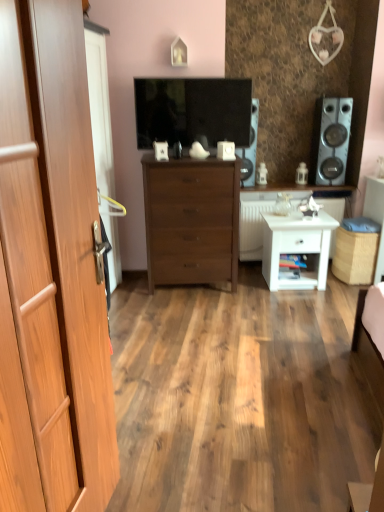
Measure the distance between matte black tv at center and camera.

matte black tv at center and camera are 11.30 feet apart.

Locate an element on the screen. Image resolution: width=384 pixels, height=512 pixels. matte black tv at center is located at coordinates (193, 111).

Locate an element on the screen. This screenshot has height=512, width=384. white glossy side table at center right, placed as the 2th counter top when sorted from top to bottom is located at coordinates (273, 209).

Describe the element at coordinates (191, 221) in the screenshot. I see `brown wooden chest of drawers at center` at that location.

This screenshot has width=384, height=512. What are the coordinates of `white matte nightstand at lower right` in the screenshot? It's located at (296, 249).

Locate an element on the screen. This screenshot has width=384, height=512. matte black speaker at center, which ranks as the second speaker in right-to-left order is located at coordinates (249, 150).

Looking at their sizes, would you say light brown wood door at left is wider or thinner than wooden cabinet at center, which is the second counter top in bottom-to-top order?

light brown wood door at left is thinner than wooden cabinet at center, which is the second counter top in bottom-to-top order.

In the scene shown: Is light brown wood door at left not close to wooden cabinet at center, the 1th counter top when ordered from top to bottom?

Yes, light brown wood door at left and wooden cabinet at center, the 1th counter top when ordered from top to bottom, are located far from each other.

Between light brown wood door at left and wooden cabinet at center, the 1th counter top when ordered from top to bottom, which one has smaller size?

Smaller between the two is wooden cabinet at center, the 1th counter top when ordered from top to bottom.

Which is farther from the camera, (x=82, y=426) or (x=328, y=190)?

Point (x=328, y=190)

Can you tell me how much brown wooden chest of drawers at center and matte black speaker at center, placed as the 1th speaker when sorted from left to right, differ in facing direction?

9.3 degrees separate the facing orientations of brown wooden chest of drawers at center and matte black speaker at center, placed as the 1th speaker when sorted from left to right.

Does brown wooden chest of drawers at center have a smaller size compared to matte black speaker at center, placed as the 1th speaker when sorted from left to right?

No.

Is brown wooden chest of drawers at center with matte black speaker at center, placed as the 1th speaker when sorted from left to right?

No.

From a real-world perspective, is brown wooden chest of drawers at center located beneath matte black speaker at center, which ranks as the second speaker in right-to-left order?

Yes, from a real-world perspective, brown wooden chest of drawers at center is below matte black speaker at center, which ranks as the second speaker in right-to-left order.

Considering the positions of points (339, 101) and (175, 112), is point (339, 101) closer to camera compared to point (175, 112)?

No, it is behind (175, 112).

From the image's perspective, is satin silver speaker at right, placed as the first speaker when sorted from right to left, positioned above or below matte black tv at center?

From the image's perspective, satin silver speaker at right, placed as the first speaker when sorted from right to left, appears below matte black tv at center.

Is satin silver speaker at right, the 2th speaker from the left, far from matte black tv at center?

Yes, satin silver speaker at right, the 2th speaker from the left, and matte black tv at center are quite far apart.

Based on the photo, how far apart are satin silver speaker at right, the 2th speaker from the left, and matte black tv at center?

satin silver speaker at right, the 2th speaker from the left, is 1.33 meters from matte black tv at center.

From a real-world perspective, is matte black tv at center positioned above or below satin silver speaker at right, the 2th speaker from the left?

matte black tv at center is above satin silver speaker at right, the 2th speaker from the left.

Between matte black tv at center and satin silver speaker at right, placed as the first speaker when sorted from right to left, which one is positioned in front?

matte black tv at center is in front.

Is matte black tv at center directly adjacent to satin silver speaker at right, the 2th speaker from the left?

matte black tv at center is not next to satin silver speaker at right, the 2th speaker from the left, and they're not touching.

Is matte black tv at center not within satin silver speaker at right, placed as the first speaker when sorted from right to left?

Absolutely, matte black tv at center is external to satin silver speaker at right, placed as the first speaker when sorted from right to left.

Is wooden cabinet at center, the 1th counter top when ordered from top to bottom, in front of or behind white glossy side table at center right, marked as the 1th counter top in a bottom-to-top arrangement, in the image?

Clearly, wooden cabinet at center, the 1th counter top when ordered from top to bottom, is behind white glossy side table at center right, marked as the 1th counter top in a bottom-to-top arrangement.

Consider the image. Between wooden cabinet at center, which is the second counter top in bottom-to-top order, and white glossy side table at center right, marked as the 1th counter top in a bottom-to-top arrangement, which one has more height?

With more height is white glossy side table at center right, marked as the 1th counter top in a bottom-to-top arrangement.

Would you say wooden cabinet at center, which is the second counter top in bottom-to-top order, is outside white glossy side table at center right, placed as the 2th counter top when sorted from top to bottom?

Indeed, wooden cabinet at center, which is the second counter top in bottom-to-top order, is completely outside white glossy side table at center right, placed as the 2th counter top when sorted from top to bottom.

From the image's perspective, is wooden cabinet at center, the 1th counter top when ordered from top to bottom, below white glossy side table at center right, marked as the 1th counter top in a bottom-to-top arrangement?

No.

Does point (254, 127) lie in front of point (172, 253)?

No, it is behind (172, 253).

Could you measure the distance between matte black speaker at center, placed as the 1th speaker when sorted from left to right, and brown wooden chest of drawers at center?

matte black speaker at center, placed as the 1th speaker when sorted from left to right, is 28.40 inches away from brown wooden chest of drawers at center.

Between matte black speaker at center, placed as the 1th speaker when sorted from left to right, and brown wooden chest of drawers at center, which one has more height?

brown wooden chest of drawers at center.

Is matte black speaker at center, which ranks as the second speaker in right-to-left order, wider or thinner than brown wooden chest of drawers at center?

matte black speaker at center, which ranks as the second speaker in right-to-left order, is thinner than brown wooden chest of drawers at center.

Between white matte nightstand at lower right and brown wooden chest of drawers at center, which one is positioned in front?

brown wooden chest of drawers at center is in front.

From the image's perspective, is white matte nightstand at lower right under brown wooden chest of drawers at center?

Yes, from the image's perspective, white matte nightstand at lower right is below brown wooden chest of drawers at center.

Which point is more forward, (283, 239) or (228, 191)?

Positioned in front is point (228, 191).

How distant is white matte nightstand at lower right from brown wooden chest of drawers at center?

26.58 inches.

Identify the location of door below the wooden cabinet at center, the 1th counter top when ordered from top to bottom (from the image's perspective). Image resolution: width=384 pixels, height=512 pixels. (50, 271).

Find the location of a particular element. The width and height of the screenshot is (384, 512). chest of drawers on the left of matte black speaker at center, placed as the 1th speaker when sorted from left to right is located at coordinates (191, 221).

From the image, which object appears to be nearer to matte black speaker at center, which ranks as the second speaker in right-to-left order, matte black tv at center or brown wooden chest of drawers at center?

matte black tv at center is positioned closer to the anchor matte black speaker at center, which ranks as the second speaker in right-to-left order.

From the image, which object appears to be nearer to wooden cabinet at center, the 1th counter top when ordered from top to bottom, white glossy side table at center right, placed as the 2th counter top when sorted from top to bottom, or light brown wood door at left?

Among the two, white glossy side table at center right, placed as the 2th counter top when sorted from top to bottom, is located nearer to wooden cabinet at center, the 1th counter top when ordered from top to bottom.

Based on their spatial positions, is matte black tv at center or white glossy side table at center right, marked as the 1th counter top in a bottom-to-top arrangement, further from brown wooden chest of drawers at center?

white glossy side table at center right, marked as the 1th counter top in a bottom-to-top arrangement, is positioned further to the anchor brown wooden chest of drawers at center.

Which object lies nearer to the anchor point matte black speaker at center, placed as the 1th speaker when sorted from left to right, brown wooden chest of drawers at center or white matte nightstand at lower right?

brown wooden chest of drawers at center is positioned closer to the anchor matte black speaker at center, placed as the 1th speaker when sorted from left to right.

Looking at the image, which one is located further to matte black tv at center, white matte nightstand at lower right or brown wooden chest of drawers at center?

white matte nightstand at lower right lies further to matte black tv at center than the other object.

Based on the photo, considering their positions, is brown wooden chest of drawers at center positioned closer to light brown wood door at left than satin silver speaker at right, placed as the first speaker when sorted from right to left?

Among the two, brown wooden chest of drawers at center is located nearer to light brown wood door at left.

Estimate the real-world distances between objects in this image. Which object is closer to satin silver speaker at right, the 2th speaker from the left, white matte nightstand at lower right or brown wooden chest of drawers at center?

white matte nightstand at lower right is closer to satin silver speaker at right, the 2th speaker from the left.

From the image, which object appears to be farther from matte black tv at center, light brown wood door at left or wooden cabinet at center, the 1th counter top when ordered from top to bottom?

light brown wood door at left is positioned further to the anchor matte black tv at center.

This screenshot has height=512, width=384. In order to click on counter top between wooden cabinet at center, which is the second counter top in bottom-to-top order, and white matte nightstand at lower right, in the vertical direction in this screenshot , I will do `click(273, 209)`.

You are a GUI agent. You are given a task and a screenshot of the screen. Output one action in this format:
    pyautogui.click(x=<x>, y=<y>)
    Task: Click on the nightstand situated between matte black tv at center and satin silver speaker at right, placed as the first speaker when sorted from right to left, from left to right
    
    Given the screenshot: What is the action you would take?
    pyautogui.click(x=296, y=249)

Find the location of `television positioned between light brown wood door at left and white glossy side table at center right, marked as the 1th counter top in a bottom-to-top arrangement, from near to far`. television positioned between light brown wood door at left and white glossy side table at center right, marked as the 1th counter top in a bottom-to-top arrangement, from near to far is located at coordinates (193, 111).

Identify the location of the chest of drawers located between light brown wood door at left and matte black speaker at center, placed as the 1th speaker when sorted from left to right, in the depth direction. (191, 221).